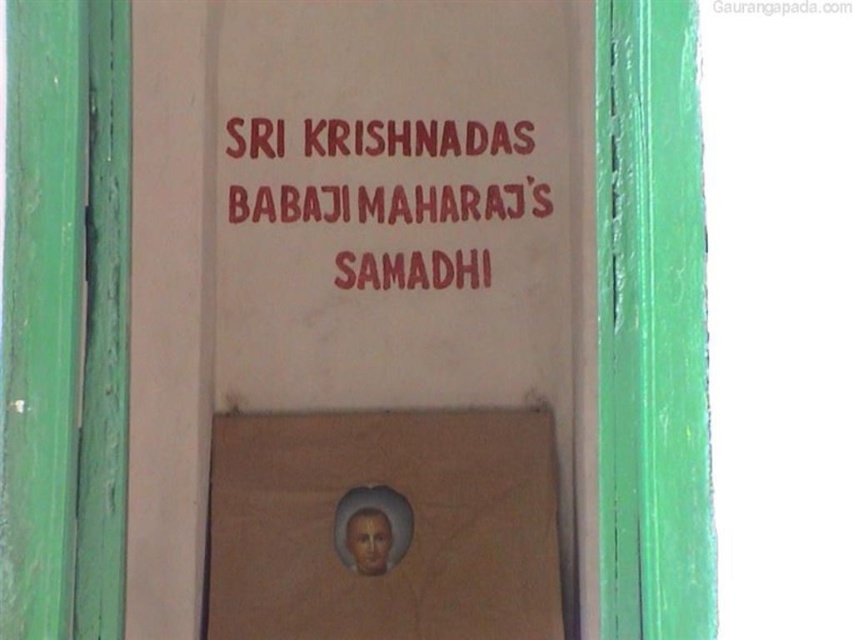
The height and width of the screenshot is (640, 853). I want to click on brown cardboard at center, so [383, 525].

The image size is (853, 640). In order to click on brown cardboard at center in this screenshot , I will do `click(383, 525)`.

Is white matte signboard at center below red painted text at upper center?

Correct, white matte signboard at center is located below red painted text at upper center.

Consider the image. Can you confirm if white matte signboard at center is shorter than red painted text at upper center?

No.

Who is more forward, (410, 326) or (358, 145)?

Point (410, 326)

I want to click on white matte signboard at center, so click(361, 314).

From the picture: Between white matte signboard at center and brown cardboard at center, which one appears on the left side from the viewer's perspective?

From the viewer's perspective, white matte signboard at center appears more on the left side.

Which is below, white matte signboard at center or brown cardboard at center?

Positioned lower is brown cardboard at center.

Locate an element on the screen. The width and height of the screenshot is (853, 640). white matte signboard at center is located at coordinates (361, 314).